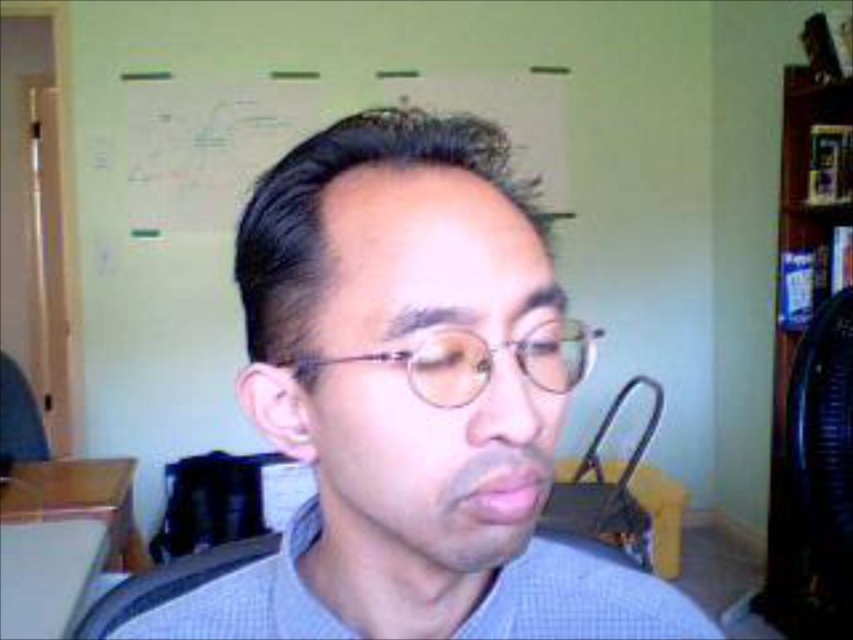
Image resolution: width=853 pixels, height=640 pixels. I want to click on matte gray shirt at center, so click(x=410, y=401).

Measure the distance between matte gray shirt at center and camera.

matte gray shirt at center is 11.31 inches away from camera.

The height and width of the screenshot is (640, 853). Describe the element at coordinates (410, 401) in the screenshot. I see `matte gray shirt at center` at that location.

Locate an element on the screen. The height and width of the screenshot is (640, 853). matte gray shirt at center is located at coordinates (410, 401).

Does matte gray shirt at center come behind clear plastic glasses at center?

That is False.

Which is more to the left, matte gray shirt at center or clear plastic glasses at center?

matte gray shirt at center

Which is in front, point (138, 634) or point (554, 358)?

Point (554, 358) is more forward.

Where is `matte gray shirt at center`? The height and width of the screenshot is (640, 853). matte gray shirt at center is located at coordinates (410, 401).

Does matte glass glasses at center appear under clear plastic glasses at center?

Yes.

Between matte glass glasses at center and clear plastic glasses at center, which one has more height?

Standing taller between the two is matte glass glasses at center.

The width and height of the screenshot is (853, 640). I want to click on matte glass glasses at center, so click(428, 465).